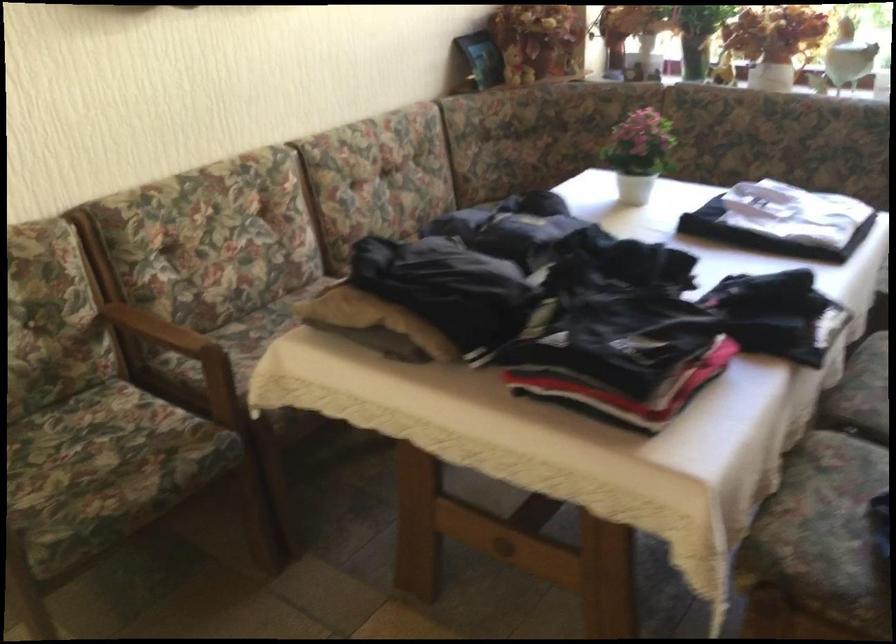
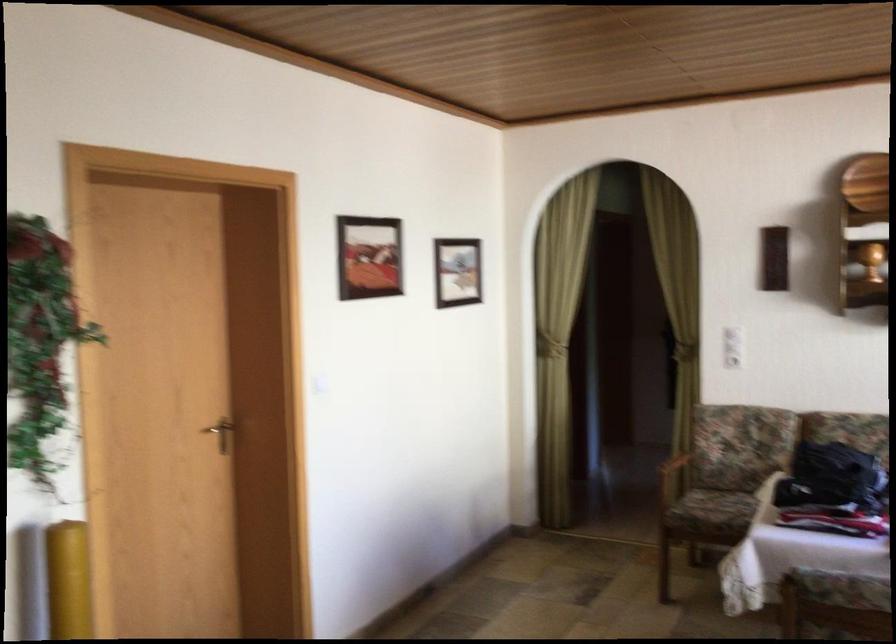
The point at (595, 310) is marked in the first image. Where is the corresponding point in the second image?

(831, 478)